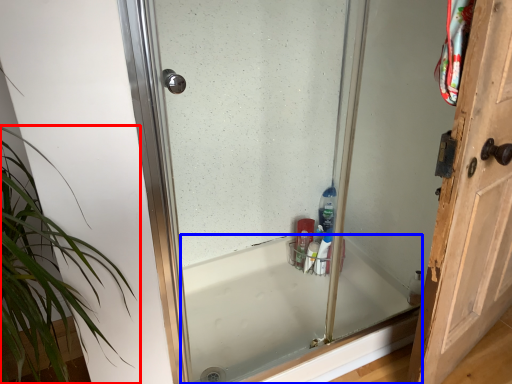
Question: Which point is closer to the camera, houseplant (highlighted by a red box) or bathtub (highlighted by a blue box)?

Choices:
 (A) houseplant
 (B) bathtub

Answer: (A)